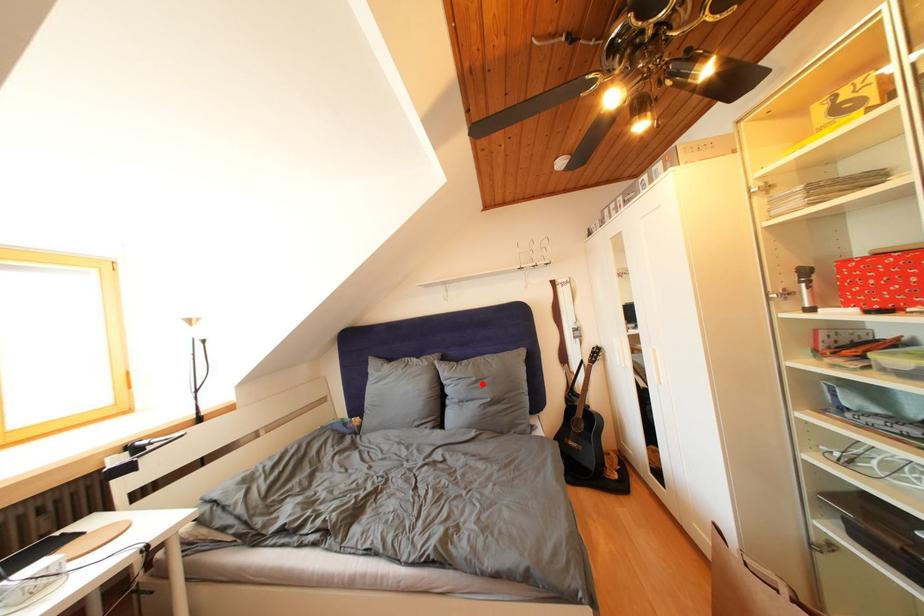
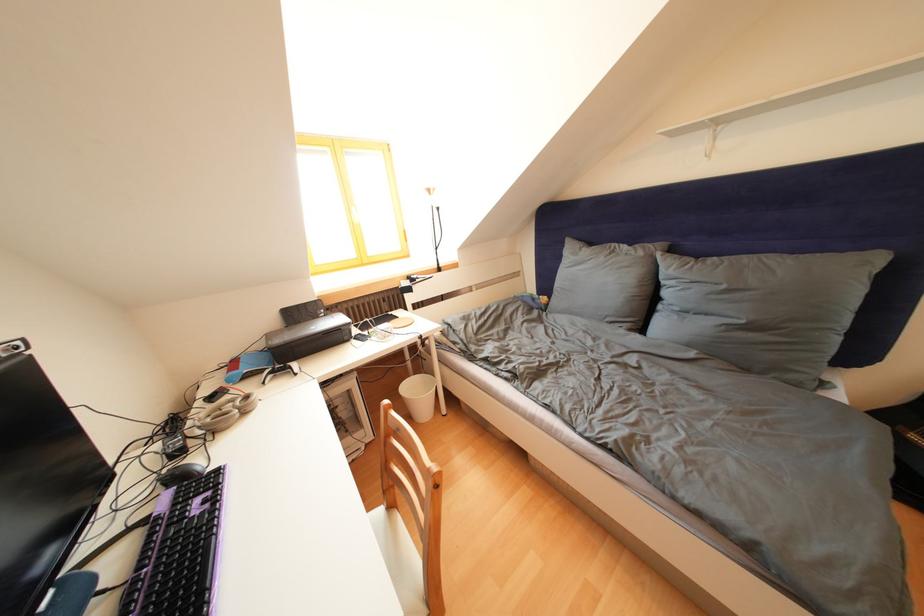
Question: I am providing you with two images of the same scene from different viewpoints. Given a red point in image1, look at the same physical point in image2. Is it:

Choices:
 (A) Closer to the viewpoint
 (B) Farther from the viewpoint

Answer: (A)